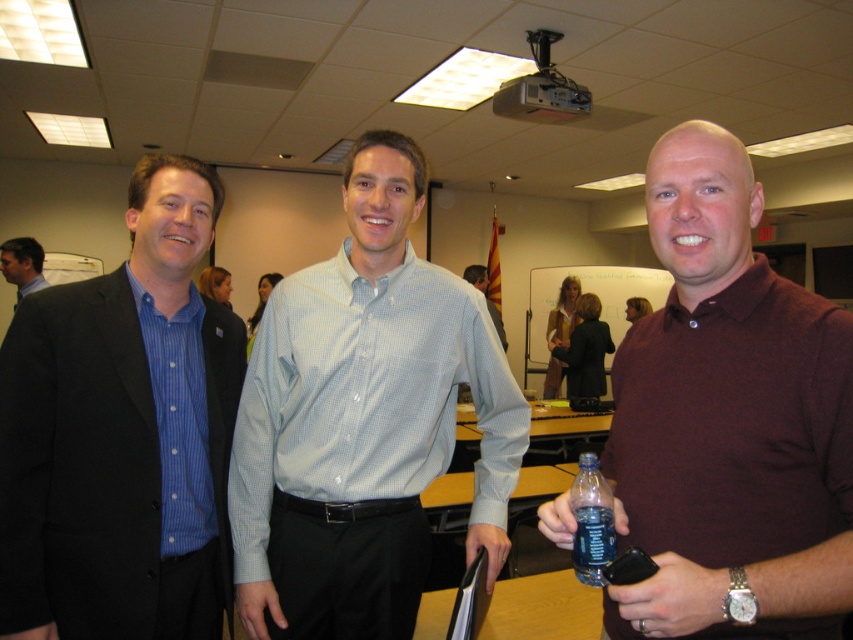
Is point (325, 314) less distant than point (474, 268)?

Yes.

Is light blue checkered shirt at center thinner than light blue shirt at center?

No, light blue checkered shirt at center is not thinner than light blue shirt at center.

Who is more distant from viewer, (370, 628) or (477, 275)?

The point (477, 275) is behind.

I want to click on light blue checkered shirt at center, so click(x=363, y=420).

Between maroon polo shirt at right and light blue checkered shirt at center, which one has more height?

Standing taller between the two is light blue checkered shirt at center.

In the scene shown: Can you confirm if maroon polo shirt at right is positioned to the right of light blue checkered shirt at center?

Yes, maroon polo shirt at right is to the right of light blue checkered shirt at center.

Is point (787, 588) farther from camera compared to point (410, 536)?

No, it is in front of (410, 536).

Where is `maroon polo shirt at right`? This screenshot has height=640, width=853. maroon polo shirt at right is located at coordinates (729, 420).

Is point (376, 442) closer to viewer compared to point (640, 310)?

Yes.

Does light blue checkered shirt at center have a greater height compared to matte burgundy polo shirt at right?

Correct, light blue checkered shirt at center is much taller as matte burgundy polo shirt at right.

This screenshot has width=853, height=640. Describe the element at coordinates (363, 420) in the screenshot. I see `light blue checkered shirt at center` at that location.

Identify the location of light blue checkered shirt at center. Image resolution: width=853 pixels, height=640 pixels. (363, 420).